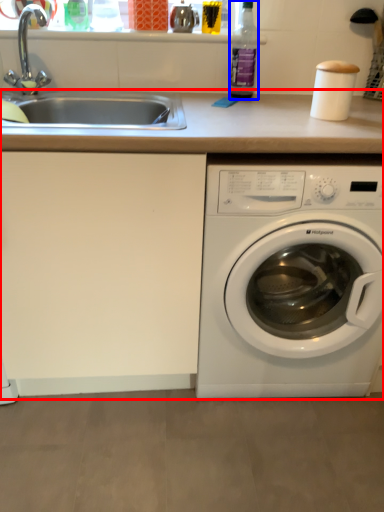
Question: Which point is closer to the camera, counter top (highlighted by a red box) or bottle (highlighted by a blue box)?

Choices:
 (A) counter top
 (B) bottle

Answer: (A)